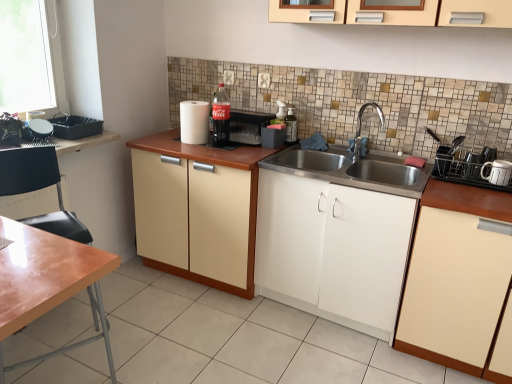
You are a GUI agent. You are given a task and a screenshot of the screen. Output one action in this format:
    pyautogui.click(x=<x>, y=<y>)
    Task: Click on the free spot in front of black plastic toaster at right, the second appliance in the right-to-left sequence
    
    Given the screenshot: What is the action you would take?
    pyautogui.click(x=482, y=188)